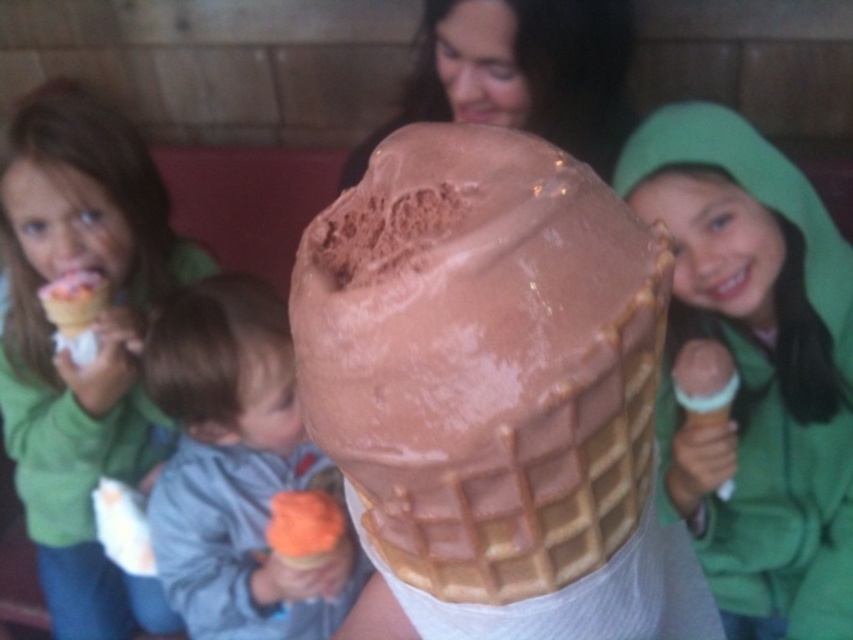
Question: Considering the relative positions of matte green hoodie at upper right and matte green hoodie at left in the image provided, where is matte green hoodie at upper right located with respect to matte green hoodie at left?

Choices:
 (A) above
 (B) below

Answer: (A)

Question: Does orange waffle cone at lower left appear under smooth chocolate ice cream at center?

Choices:
 (A) yes
 (B) no

Answer: (A)

Question: Can you confirm if white creamy ice cream at right is positioned above soft pink ice cream at left?

Choices:
 (A) yes
 (B) no

Answer: (B)

Question: Among these points, which one is nearest to the camera?

Choices:
 (A) (178, 328)
 (B) (640, 164)

Answer: (B)

Question: Which point is farther to the camera?

Choices:
 (A) (233, 358)
 (B) (717, 308)
 (C) (76, 102)
 (D) (726, 362)

Answer: (C)

Question: Among these objects, which one is farthest from the camera?

Choices:
 (A) matte green hoodie at upper right
 (B) chocolate matte ice cream cone at center
 (C) soft pink ice cream at left

Answer: (C)